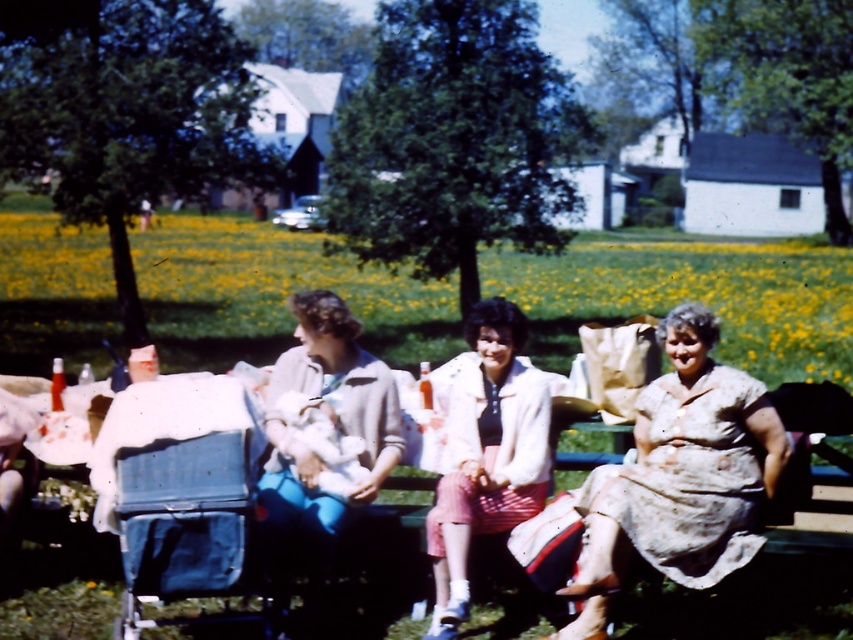
Which is above, floral-patterned dress at center or blue fabric baby carriage at left?

Positioned higher is floral-patterned dress at center.

Is floral-patterned dress at center further to the viewer compared to blue fabric baby carriage at left?

Yes, it is.

In order to click on floral-patterned dress at center in this screenshot , I will do `click(680, 476)`.

You are a GUI agent. You are given a task and a screenshot of the screen. Output one action in this format:
    pyautogui.click(x=<x>, y=<y>)
    Task: Click on the floral-patterned dress at center
    This screenshot has width=853, height=640.
    Given the screenshot: What is the action you would take?
    coord(680,476)

Is floral-patterned dress at center positioned before white textured jacket at center?

Yes, floral-patterned dress at center is in front of white textured jacket at center.

Who is higher up, floral-patterned dress at center or white textured jacket at center?

white textured jacket at center is higher up.

In order to click on floral-patterned dress at center in this screenshot , I will do `click(680, 476)`.

Where is `floral-patterned dress at center`? The width and height of the screenshot is (853, 640). floral-patterned dress at center is located at coordinates pyautogui.click(x=680, y=476).

Who is taller, blue fabric baby carriage at left or white textured jacket at center?

white textured jacket at center

The height and width of the screenshot is (640, 853). Describe the element at coordinates (181, 493) in the screenshot. I see `blue fabric baby carriage at left` at that location.

Locate an element on the screen. blue fabric baby carriage at left is located at coordinates (181, 493).